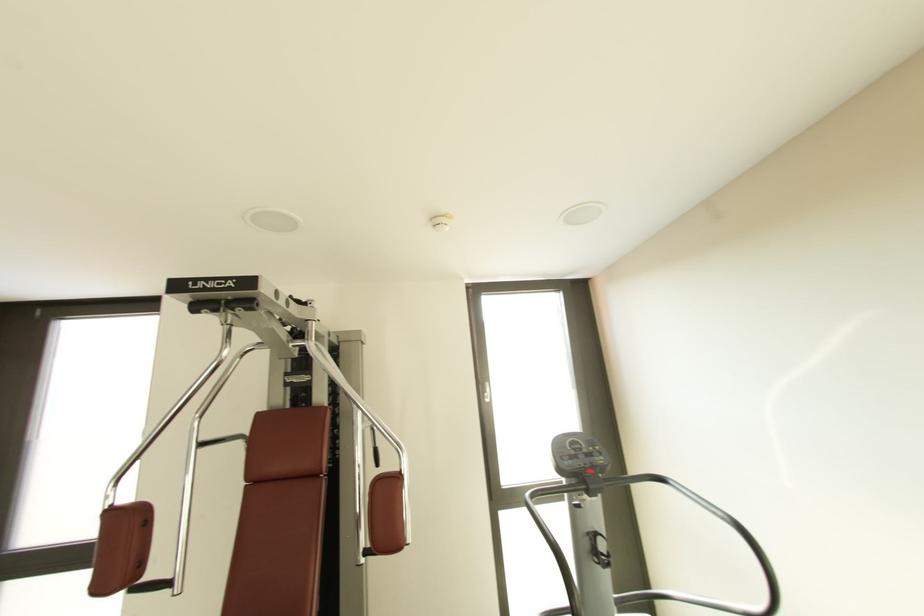
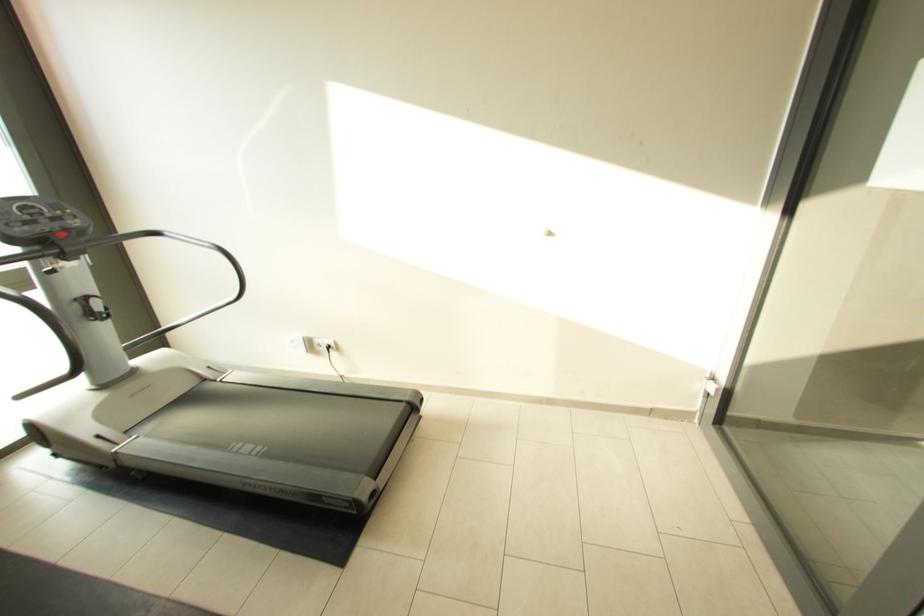
Where in the second image is the point corresponding to point (727, 520) from the first image?

(214, 249)